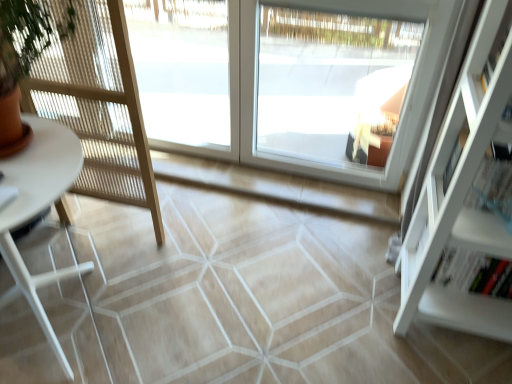
Question: Can you confirm if white glossy table at left is bigger than transparent glass window at center, placed as the 1th window when sorted from left to right?

Choices:
 (A) yes
 (B) no

Answer: (A)

Question: Is white glossy table at left directly adjacent to transparent glass window at center, which appears as the 3th window when viewed from the right?

Choices:
 (A) yes
 (B) no

Answer: (B)

Question: Is the depth of white glossy table at left greater than that of transparent glass window at center, placed as the 1th window when sorted from left to right?

Choices:
 (A) yes
 (B) no

Answer: (B)

Question: Can you confirm if white glossy table at left is smaller than transparent glass window at center, placed as the 1th window when sorted from left to right?

Choices:
 (A) no
 (B) yes

Answer: (A)

Question: Does white glossy table at left appear on the right side of transparent glass window at center, placed as the 1th window when sorted from left to right?

Choices:
 (A) yes
 (B) no

Answer: (B)

Question: Is point [x=19, y=266] closer or farther from the camera than point [x=499, y=56]?

Choices:
 (A) closer
 (B) farther

Answer: (B)

Question: Choose the correct answer: Is white glossy table at left inside white matte shelf at right or outside it?

Choices:
 (A) outside
 (B) inside

Answer: (A)

Question: In terms of height, does white glossy table at left look taller or shorter compared to white matte shelf at right?

Choices:
 (A) tall
 (B) short

Answer: (B)

Question: From a real-world perspective, is white glossy table at left above or below white matte shelf at right?

Choices:
 (A) below
 (B) above

Answer: (A)

Question: Would you say white glass window at center, placed as the 2th window when sorted from right to left, is inside or outside transparent glass window at center, placed as the 3th window when sorted from left to right?

Choices:
 (A) outside
 (B) inside

Answer: (B)

Question: Does point (379, 39) appear closer or farther from the camera than point (293, 104)?

Choices:
 (A) closer
 (B) farther

Answer: (A)

Question: Considering their positions, is white glass window at center, positioned as the second window in left-to-right order, located in front of or behind transparent glass window at center, placed as the 3th window when sorted from left to right?

Choices:
 (A) behind
 (B) front

Answer: (A)

Question: Looking at their shapes, would you say white glass window at center, positioned as the second window in left-to-right order, is wider or thinner than transparent glass window at center, placed as the 3th window when sorted from left to right?

Choices:
 (A) thin
 (B) wide

Answer: (A)

Question: Relative to white glass window at center, placed as the 2th window when sorted from right to left, is transparent glass window at center, which appears as the 3th window when viewed from the right, in front or behind?

Choices:
 (A) front
 (B) behind

Answer: (B)

Question: Is point (179, 107) closer or farther from the camera than point (394, 125)?

Choices:
 (A) closer
 (B) farther

Answer: (B)